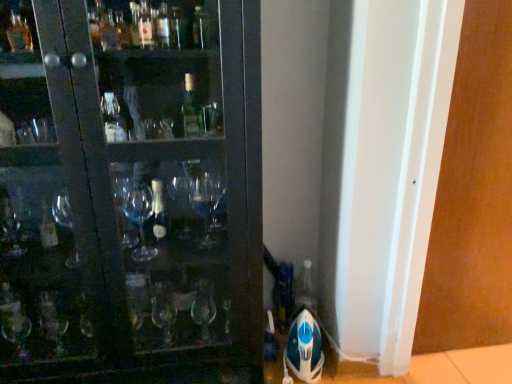
The image size is (512, 384). I want to click on brown matte screen door at right, arranged as the second screen door when viewed from the left, so (473, 195).

The width and height of the screenshot is (512, 384). What do you see at coordinates (473, 195) in the screenshot?
I see `brown matte screen door at right, arranged as the 1th screen door when viewed from the right` at bounding box center [473, 195].

Image resolution: width=512 pixels, height=384 pixels. In order to click on white glossy screen door at right, positioned as the 2th screen door in right-to-left order in this screenshot , I will do `click(387, 168)`.

What is the approximate width of white glossy screen door at right, positioned as the 2th screen door in right-to-left order?

white glossy screen door at right, positioned as the 2th screen door in right-to-left order, is 10.05 inches in width.

This screenshot has width=512, height=384. Describe the element at coordinates (387, 168) in the screenshot. I see `white glossy screen door at right, marked as the first screen door in a left-to-right arrangement` at that location.

In order to click on brown matte screen door at right, arranged as the 1th screen door when viewed from the right in this screenshot , I will do `click(473, 195)`.

Is brown matte screen door at right, arranged as the second screen door when viewed from the left, to the left of white glossy screen door at right, marked as the first screen door in a left-to-right arrangement, from the viewer's perspective?

Incorrect, brown matte screen door at right, arranged as the second screen door when viewed from the left, is not on the left side of white glossy screen door at right, marked as the first screen door in a left-to-right arrangement.

Is brown matte screen door at right, arranged as the second screen door when viewed from the left, closer to the viewer compared to white glossy screen door at right, marked as the first screen door in a left-to-right arrangement?

No, brown matte screen door at right, arranged as the second screen door when viewed from the left, is further to the viewer.

Which is more distant, [465,93] or [346,88]?

The point [346,88] is behind.

From the image's perspective, which one is positioned higher, brown matte screen door at right, arranged as the second screen door when viewed from the left, or white glossy screen door at right, marked as the first screen door in a left-to-right arrangement?

brown matte screen door at right, arranged as the second screen door when viewed from the left, appears higher in the image.

From a real-world perspective, is brown matte screen door at right, arranged as the second screen door when viewed from the left, beneath white glossy screen door at right, positioned as the 2th screen door in right-to-left order?

No, from a real-world perspective, brown matte screen door at right, arranged as the second screen door when viewed from the left, is not beneath white glossy screen door at right, positioned as the 2th screen door in right-to-left order.

From the picture: In terms of width, does brown matte screen door at right, arranged as the 1th screen door when viewed from the right, look wider or thinner when compared to white glossy screen door at right, positioned as the 2th screen door in right-to-left order?

Clearly, brown matte screen door at right, arranged as the 1th screen door when viewed from the right, has more width compared to white glossy screen door at right, positioned as the 2th screen door in right-to-left order.

Between brown matte screen door at right, arranged as the second screen door when viewed from the left, and white glossy screen door at right, positioned as the 2th screen door in right-to-left order, which one has less height?

With less height is white glossy screen door at right, positioned as the 2th screen door in right-to-left order.

Which of these two, brown matte screen door at right, arranged as the 1th screen door when viewed from the right, or white glossy screen door at right, marked as the first screen door in a left-to-right arrangement, is smaller?

brown matte screen door at right, arranged as the 1th screen door when viewed from the right, is smaller.

Is brown matte screen door at right, arranged as the 1th screen door when viewed from the right, not inside white glossy screen door at right, marked as the first screen door in a left-to-right arrangement?

Absolutely, brown matte screen door at right, arranged as the 1th screen door when viewed from the right, is external to white glossy screen door at right, marked as the first screen door in a left-to-right arrangement.

Is brown matte screen door at right, arranged as the second screen door when viewed from the left, placed right next to white glossy screen door at right, marked as the first screen door in a left-to-right arrangement?

No, brown matte screen door at right, arranged as the second screen door when viewed from the left, is not with white glossy screen door at right, marked as the first screen door in a left-to-right arrangement.

Is brown matte screen door at right, arranged as the 1th screen door when viewed from the right, oriented away from white glossy screen door at right, positioned as the 2th screen door in right-to-left order?

No, brown matte screen door at right, arranged as the 1th screen door when viewed from the right, is not facing away from white glossy screen door at right, positioned as the 2th screen door in right-to-left order.

Locate an element on the screen. screen door that appears below the brown matte screen door at right, arranged as the second screen door when viewed from the left (from a real-world perspective) is located at coordinates (387, 168).

Between white glossy screen door at right, positioned as the 2th screen door in right-to-left order, and brown matte screen door at right, arranged as the 1th screen door when viewed from the right, which one appears on the left side from the viewer's perspective?

From the viewer's perspective, white glossy screen door at right, positioned as the 2th screen door in right-to-left order, appears more on the left side.

Which is in front, white glossy screen door at right, marked as the first screen door in a left-to-right arrangement, or brown matte screen door at right, arranged as the 1th screen door when viewed from the right?

white glossy screen door at right, marked as the first screen door in a left-to-right arrangement.

Which point is more distant from viewer, (x=411, y=263) or (x=500, y=228)?

The point (x=500, y=228) is farther.

From the image's perspective, is white glossy screen door at right, positioned as the 2th screen door in right-to-left order, located above brown matte screen door at right, arranged as the 1th screen door when viewed from the right?

Actually, white glossy screen door at right, positioned as the 2th screen door in right-to-left order, appears below brown matte screen door at right, arranged as the 1th screen door when viewed from the right, in the image.

From a real-world perspective, is white glossy screen door at right, marked as the first screen door in a left-to-right arrangement, over brown matte screen door at right, arranged as the 1th screen door when viewed from the right?

No, from a real-world perspective, white glossy screen door at right, marked as the first screen door in a left-to-right arrangement, is not over brown matte screen door at right, arranged as the 1th screen door when viewed from the right

Based on the photo, which of these two, white glossy screen door at right, positioned as the 2th screen door in right-to-left order, or brown matte screen door at right, arranged as the second screen door when viewed from the left, is thinner?

With smaller width is white glossy screen door at right, positioned as the 2th screen door in right-to-left order.

Considering the relative sizes of white glossy screen door at right, positioned as the 2th screen door in right-to-left order, and brown matte screen door at right, arranged as the 1th screen door when viewed from the right, in the image provided, is white glossy screen door at right, positioned as the 2th screen door in right-to-left order, shorter than brown matte screen door at right, arranged as the 1th screen door when viewed from the right,?

Yes, white glossy screen door at right, positioned as the 2th screen door in right-to-left order, is shorter than brown matte screen door at right, arranged as the 1th screen door when viewed from the right.

Based on their sizes in the image, would you say white glossy screen door at right, marked as the first screen door in a left-to-right arrangement, is bigger or smaller than brown matte screen door at right, arranged as the 1th screen door when viewed from the right?

white glossy screen door at right, marked as the first screen door in a left-to-right arrangement, is bigger than brown matte screen door at right, arranged as the 1th screen door when viewed from the right.

Is white glossy screen door at right, marked as the first screen door in a left-to-right arrangement, not within brown matte screen door at right, arranged as the 1th screen door when viewed from the right?

Indeed, white glossy screen door at right, marked as the first screen door in a left-to-right arrangement, is completely outside brown matte screen door at right, arranged as the 1th screen door when viewed from the right.

Is white glossy screen door at right, positioned as the 2th screen door in right-to-left order, far from brown matte screen door at right, arranged as the second screen door when viewed from the left?

No, white glossy screen door at right, positioned as the 2th screen door in right-to-left order, is not far away from brown matte screen door at right, arranged as the second screen door when viewed from the left.

Does white glossy screen door at right, positioned as the 2th screen door in right-to-left order, turn towards brown matte screen door at right, arranged as the 1th screen door when viewed from the right?

No, white glossy screen door at right, positioned as the 2th screen door in right-to-left order, does not turn towards brown matte screen door at right, arranged as the 1th screen door when viewed from the right.

What are the coordinates of `screen door that appears below the brown matte screen door at right, arranged as the 1th screen door when viewed from the right (from the image's perspective)` in the screenshot? It's located at (387, 168).

At what (x,y) coordinates should I click in order to perform the action: click on screen door on the right of white glossy screen door at right, positioned as the 2th screen door in right-to-left order. Please return your answer as a coordinate pair (x, y). Looking at the image, I should click on (473, 195).

Locate an element on the screen. screen door that is behind the white glossy screen door at right, marked as the first screen door in a left-to-right arrangement is located at coordinates (473, 195).